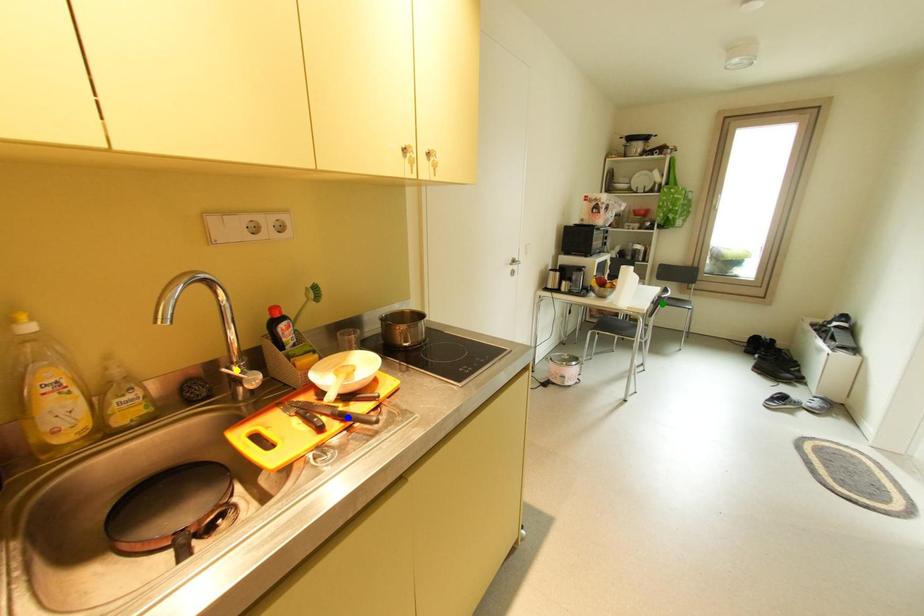
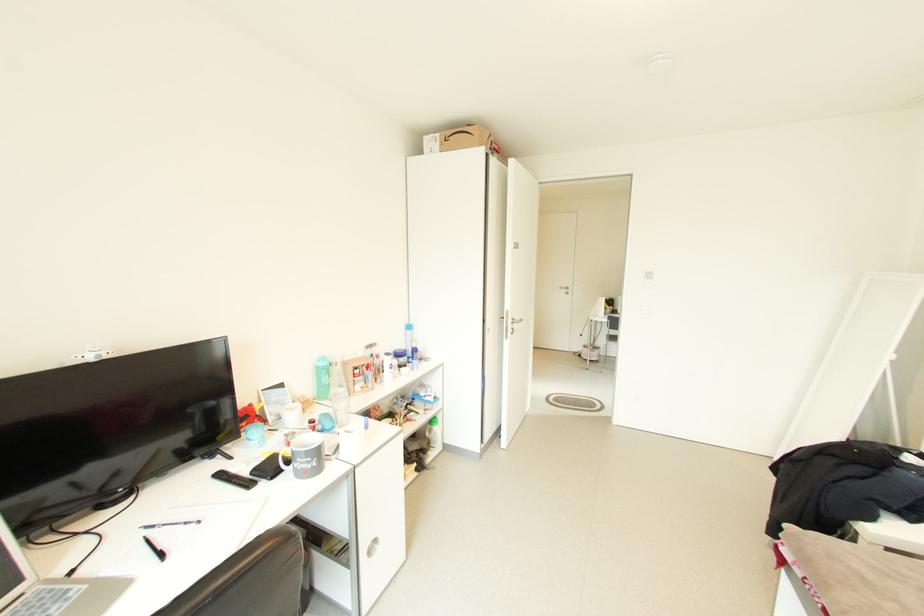
I am providing you with two images of the same scene from different viewpoints. Three points are marked in image1. Which point corresponds to a part or object that is occluded in image2?In image1, three points are marked. Which of them correspond to a part or object that is occluded in image2?Among the three points shown in image1, which one corresponds to a part or object that is no longer visible due to occlusion in image2?

green point, yellow point, blue point